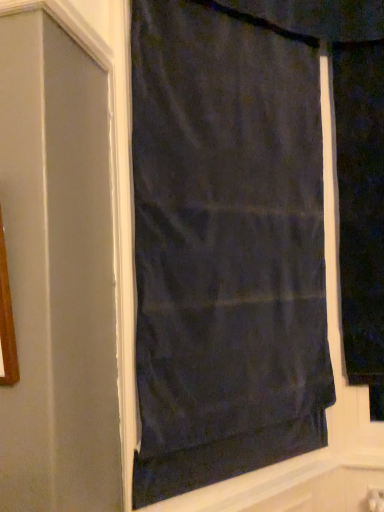
Question: Considering the positions of black fabric curtain at right, which is the second curtain in left-to-right order, and dark matte fabric curtain at center, the 2th curtain from the right, in the image, is black fabric curtain at right, which is the second curtain in left-to-right order, bigger or smaller than dark matte fabric curtain at center, the 2th curtain from the right,?

Choices:
 (A) big
 (B) small

Answer: (B)

Question: Is black fabric curtain at right, which is the second curtain in left-to-right order, inside or outside of dark matte fabric curtain at center, the 2th curtain from the right?

Choices:
 (A) outside
 (B) inside

Answer: (A)

Question: From a real-world perspective, is black fabric curtain at right, which is the second curtain in left-to-right order, physically located above or below dark matte fabric curtain at center, the 2th curtain from the right?

Choices:
 (A) above
 (B) below

Answer: (A)

Question: Based on their positions, is dark matte fabric curtain at center, the 2th curtain from the right, located to the left or right of black fabric curtain at right, which is the second curtain in left-to-right order?

Choices:
 (A) right
 (B) left

Answer: (B)

Question: Is dark matte fabric curtain at center, the 2th curtain from the right, in front of or behind black fabric curtain at right, which is the second curtain in left-to-right order, in the image?

Choices:
 (A) front
 (B) behind

Answer: (A)

Question: From the image's perspective, is dark matte fabric curtain at center, the 2th curtain from the right, positioned above or below black fabric curtain at right, which is counted as the 1th curtain, starting from the right?

Choices:
 (A) below
 (B) above

Answer: (A)

Question: From a real-world perspective, is dark matte fabric curtain at center, the 2th curtain from the right, positioned above or below black fabric curtain at right, which is counted as the 1th curtain, starting from the right?

Choices:
 (A) below
 (B) above

Answer: (A)